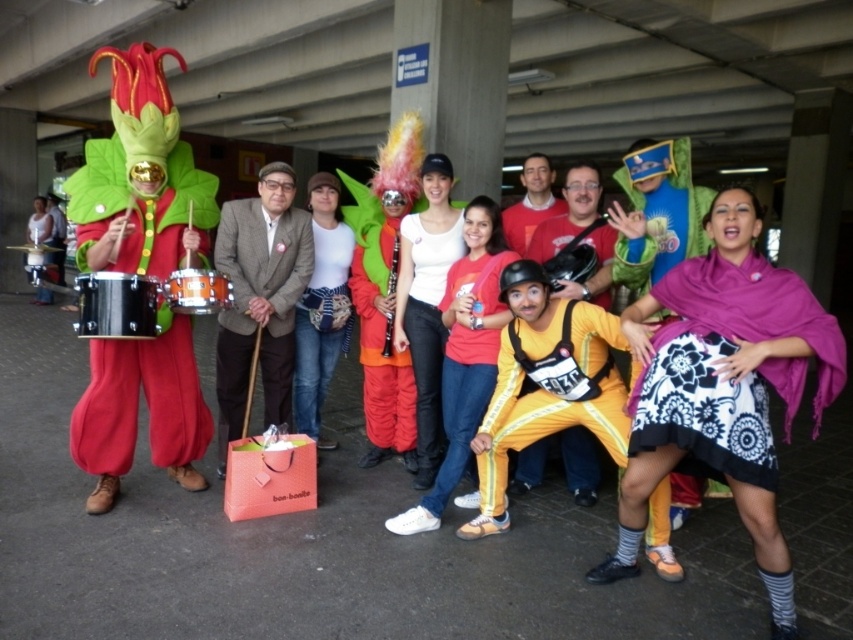
Question: Does floral-patterned skirt at center appear on the left side of metallic drum at lower left?

Choices:
 (A) no
 (B) yes

Answer: (A)

Question: Is yellow matte costume at center to the right of metallic drum at lower left from the viewer's perspective?

Choices:
 (A) yes
 (B) no

Answer: (A)

Question: Which point is closer to the camera taking this photo?

Choices:
 (A) (149, 326)
 (B) (682, 317)
 (C) (393, 246)

Answer: (B)

Question: Which point appears farthest from the camera in this image?

Choices:
 (A) (395, 312)
 (B) (107, 294)
 (C) (578, 177)

Answer: (A)

Question: Is orange fabric clarinet at center positioned before metallic drum at lower left?

Choices:
 (A) no
 (B) yes

Answer: (A)

Question: Which point is farther to the camera?

Choices:
 (A) (262, 369)
 (B) (645, 397)
 (C) (695, 454)

Answer: (A)